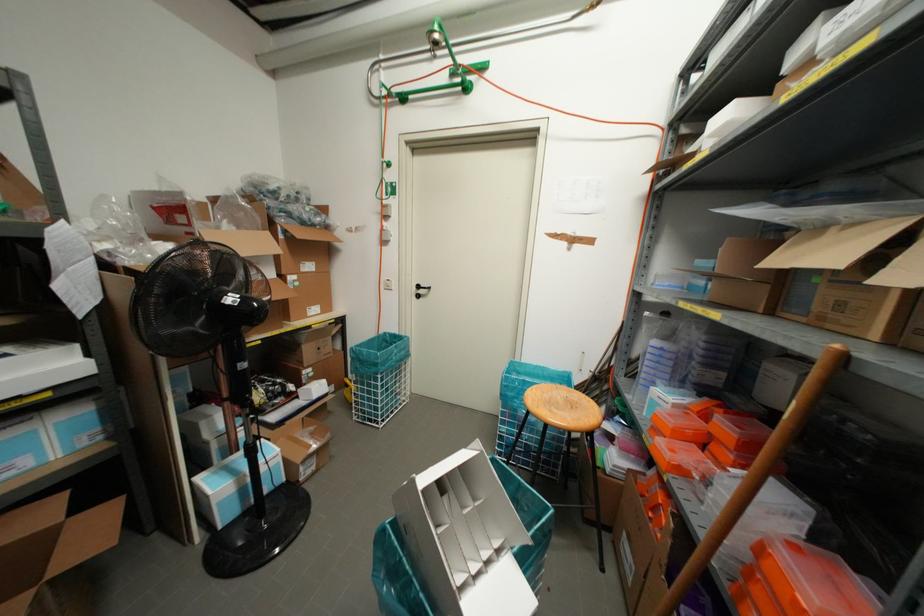
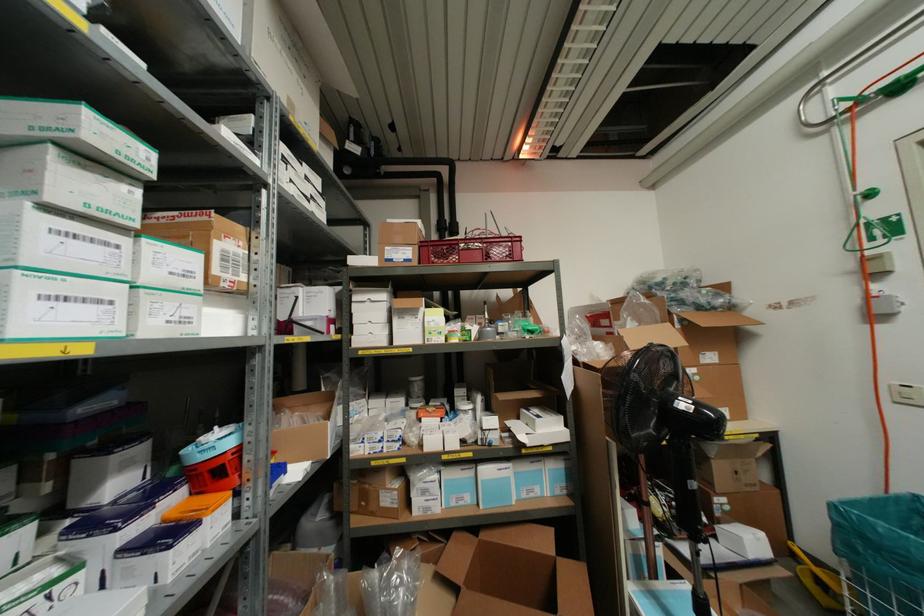
Question: How did the camera likely rotate?

Choices:
 (A) Left
 (B) Right
 (C) Up
 (D) Down

Answer: (A)